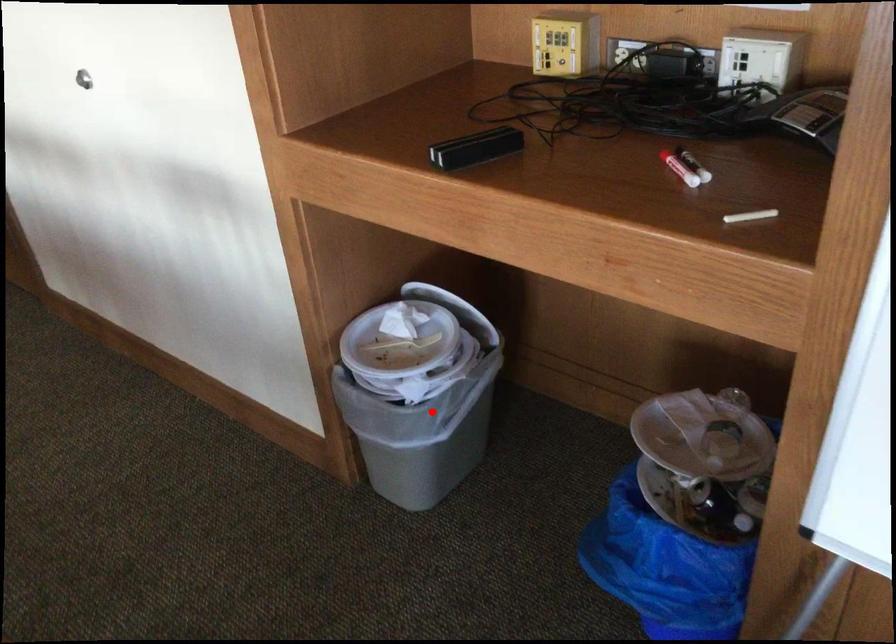
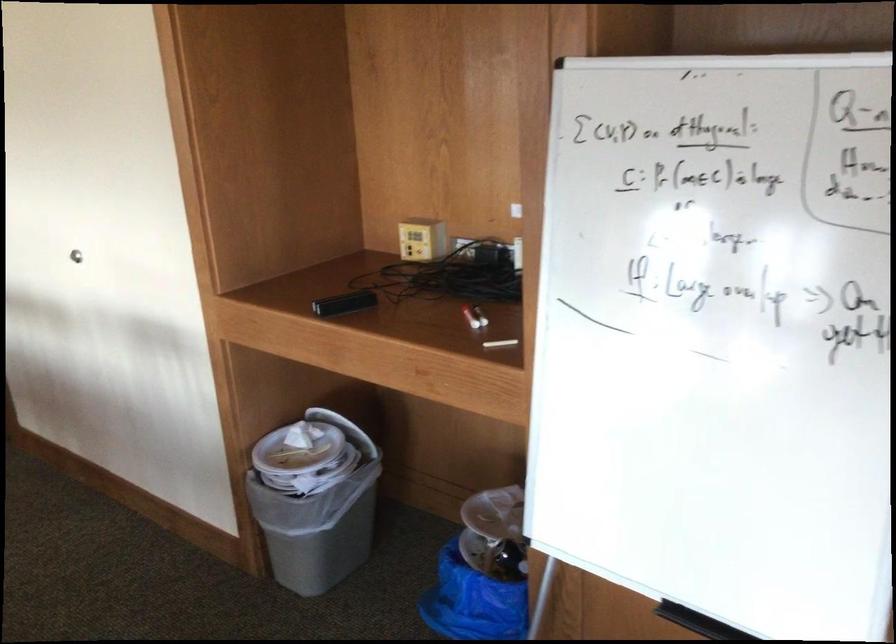
Locate, in the second image, the point that corresponds to the highlighted location in the first image.

(316, 506)